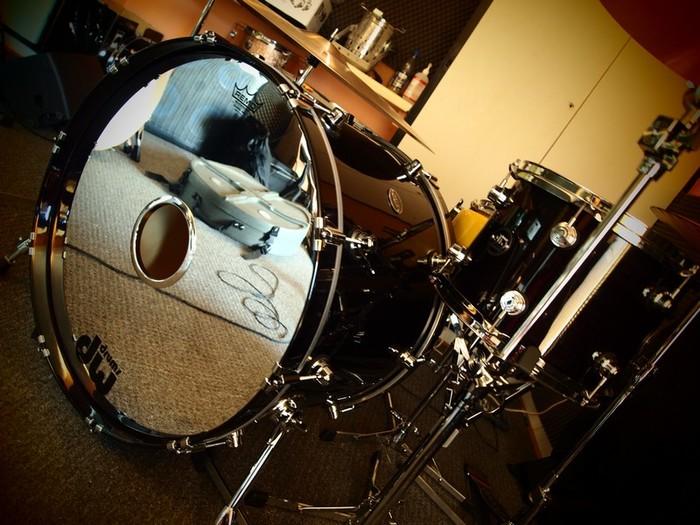
Where is `cord`? The width and height of the screenshot is (700, 525). cord is located at coordinates (524, 411).